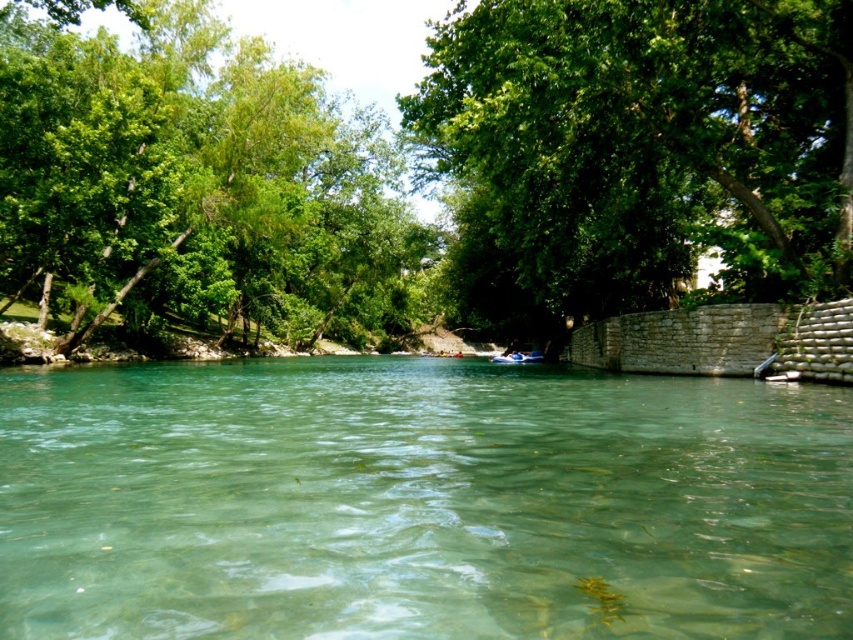
You are planning to take a photo of the green leafy tree at center and the green leafy tree at left. Which tree should you focus on if you want to capture the one with a narrower trunk?

The green leafy tree at center is thinner than the green leafy tree at left, so you should focus on the green leafy tree at center to capture the one with a narrower trunk.